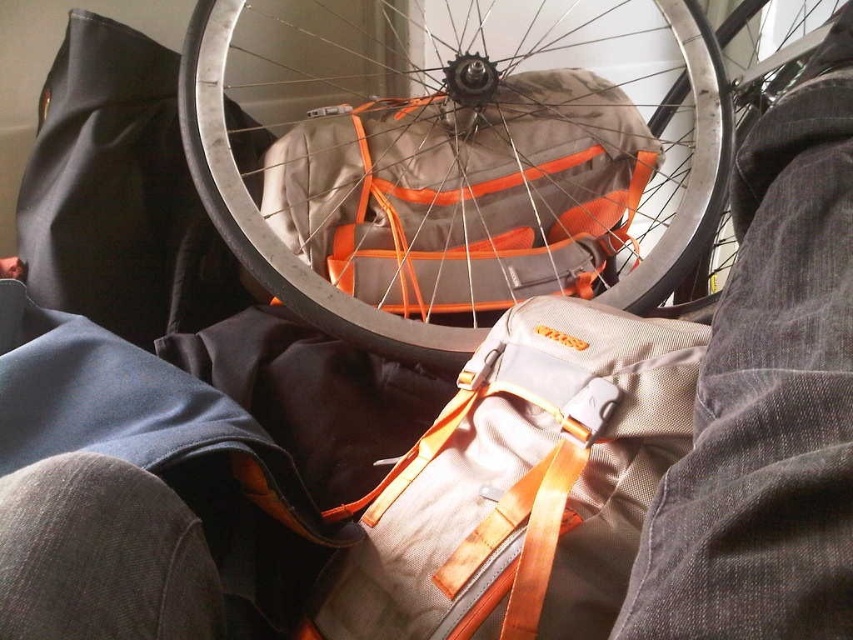
Question: Does metallic silver wheel at center appear on the right side of gray fabric pants at lower right?

Choices:
 (A) yes
 (B) no

Answer: (B)

Question: Which object is closer to the camera taking this photo?

Choices:
 (A) matte gray backpack at center
 (B) shiny metallic rim at center

Answer: (A)

Question: Estimate the real-world distances between objects in this image. Which object is farther from the metallic silver wheel at center?

Choices:
 (A) matte gray backpack at center
 (B) shiny metallic rim at center

Answer: (A)

Question: Does metallic silver wheel at center appear on the left side of gray fabric pants at lower right?

Choices:
 (A) no
 (B) yes

Answer: (B)

Question: Which point appears closest to the camera in this image?

Choices:
 (A) (815, 83)
 (B) (219, 84)

Answer: (A)

Question: Is matte gray backpack at center further to camera compared to shiny metallic rim at center?

Choices:
 (A) yes
 (B) no

Answer: (B)